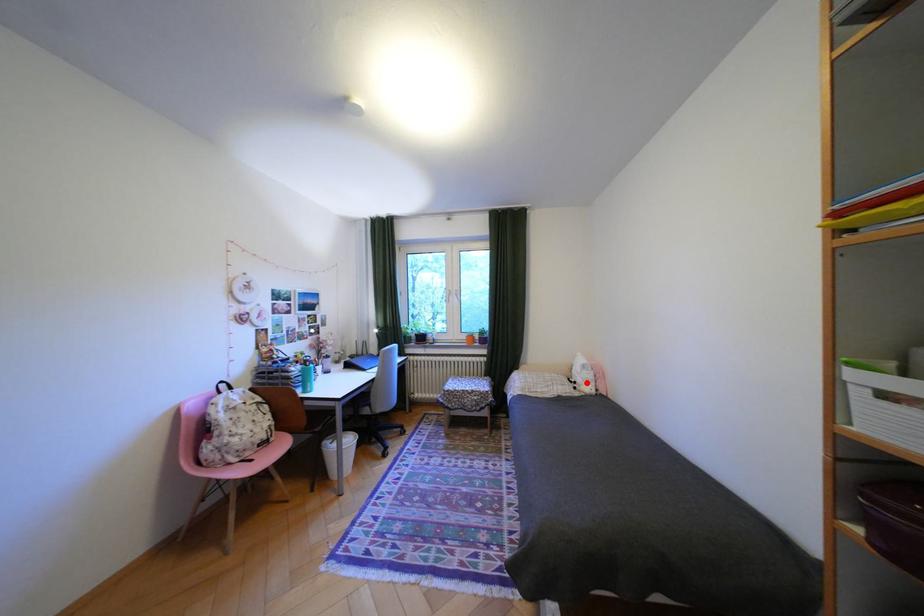
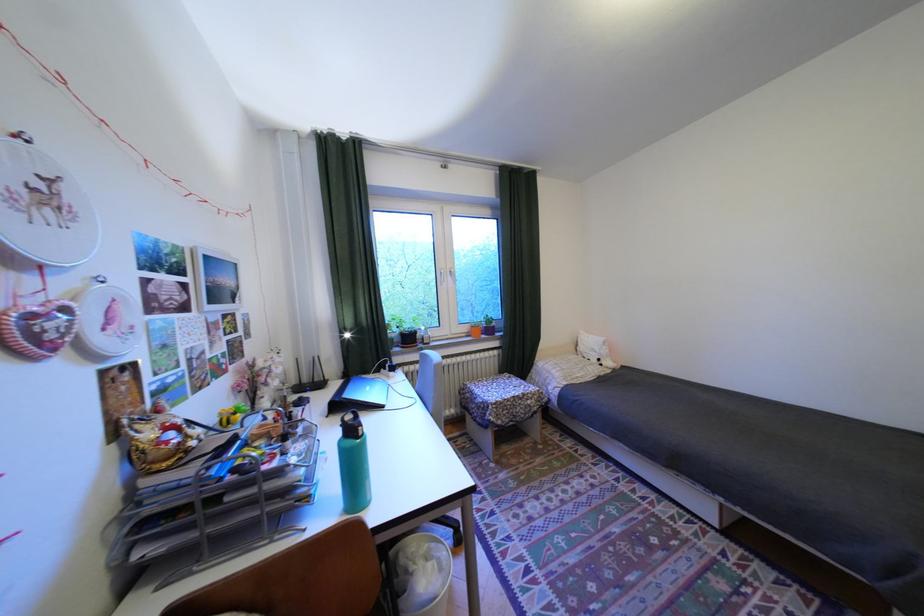
The point at the highlighted location is marked in the first image. Where is the corresponding point in the second image?

(611, 360)